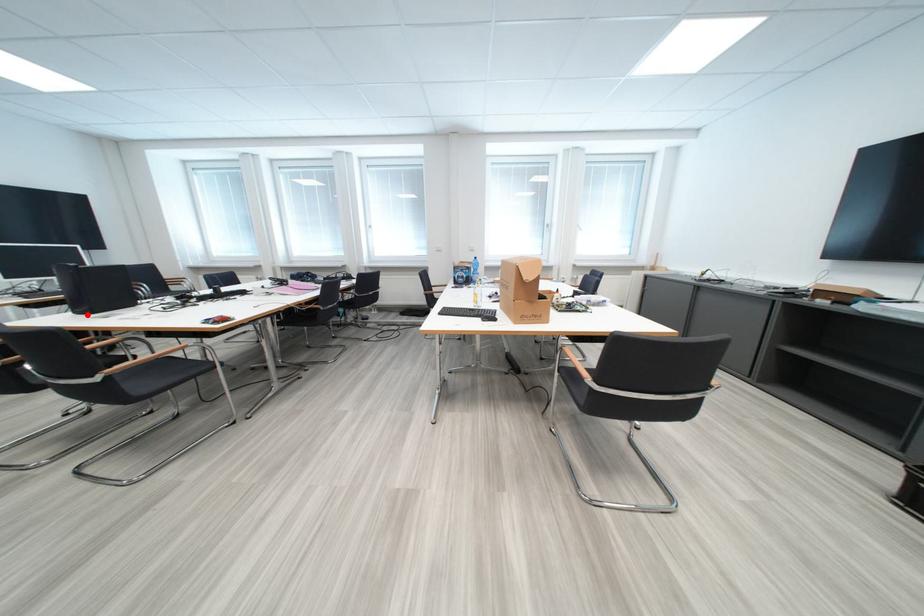
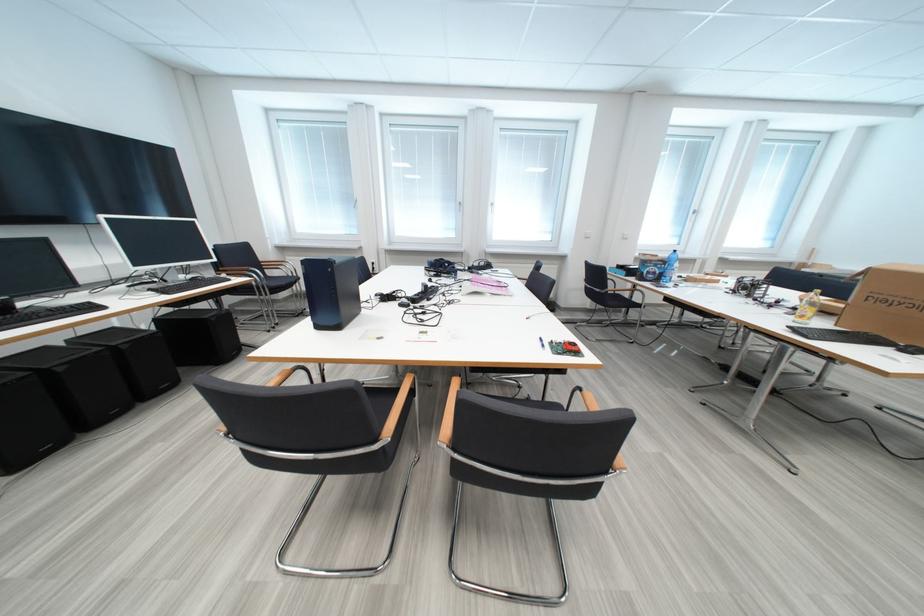
Where in the second image is the point corresponding to the highlighted location from the first image?

(329, 330)